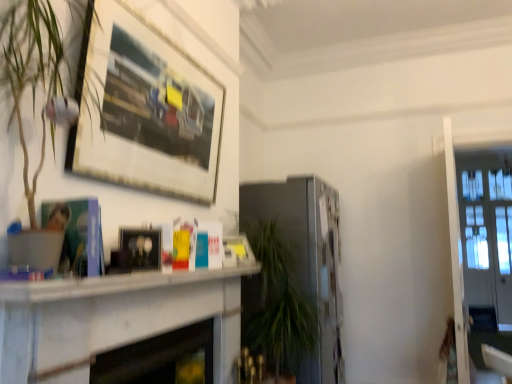
Question: Is white marble fireplace at center, positioned as the 2th fireplace in back-to-front order, not within satin silver fireplace at center, the first fireplace in the right-to-left sequence?

Choices:
 (A) no
 (B) yes

Answer: (B)

Question: Can you confirm if white marble fireplace at center, positioned as the 2th fireplace in back-to-front order, is shorter than satin silver fireplace at center, marked as the second fireplace in a left-to-right arrangement?

Choices:
 (A) no
 (B) yes

Answer: (B)

Question: Is white marble fireplace at center, arranged as the 1th fireplace when viewed from the front, further to the viewer compared to satin silver fireplace at center, marked as the second fireplace in a left-to-right arrangement?

Choices:
 (A) yes
 (B) no

Answer: (B)

Question: From the image's perspective, does white marble fireplace at center, arranged as the 1th fireplace when viewed from the front, appear higher than satin silver fireplace at center, the first fireplace in the right-to-left sequence?

Choices:
 (A) yes
 (B) no

Answer: (A)

Question: From a real-world perspective, does white marble fireplace at center, positioned as the 2th fireplace in back-to-front order, stand above satin silver fireplace at center, the 2th fireplace in the front-to-back sequence?

Choices:
 (A) yes
 (B) no

Answer: (B)

Question: In terms of height, does satin silver fireplace at center, marked as the second fireplace in a left-to-right arrangement, look taller or shorter compared to wooden picture frame at upper left, which is the 2th picture frame in bottom-to-top order?

Choices:
 (A) tall
 (B) short

Answer: (A)

Question: From the image's perspective, relative to wooden picture frame at upper left, which appears as the 1th picture frame when viewed from the top, is satin silver fireplace at center, the first fireplace in the right-to-left sequence, above or below?

Choices:
 (A) above
 (B) below

Answer: (B)

Question: Is satin silver fireplace at center, the first fireplace viewed from the back, situated inside wooden picture frame at upper left, which appears as the 1th picture frame when viewed from the top, or outside?

Choices:
 (A) inside
 (B) outside

Answer: (B)

Question: Considering the relative positions of satin silver fireplace at center, marked as the second fireplace in a left-to-right arrangement, and wooden picture frame at upper left, which appears as the 1th picture frame when viewed from the top, in the image provided, is satin silver fireplace at center, marked as the second fireplace in a left-to-right arrangement, to the left or to the right of wooden picture frame at upper left, which appears as the 1th picture frame when viewed from the top,?

Choices:
 (A) right
 (B) left

Answer: (A)

Question: From a real-world perspective, is white marble fireplace at center, the first fireplace in the left-to-right sequence, physically located above or below clear glass door at right?

Choices:
 (A) above
 (B) below

Answer: (B)

Question: Is point (131, 347) closer or farther from the camera than point (450, 170)?

Choices:
 (A) closer
 (B) farther

Answer: (A)

Question: From the image's perspective, relative to clear glass door at right, is white marble fireplace at center, placed as the 2th fireplace when sorted from right to left, above or below?

Choices:
 (A) above
 (B) below

Answer: (B)

Question: In terms of size, does white marble fireplace at center, the first fireplace in the left-to-right sequence, appear bigger or smaller than clear glass door at right?

Choices:
 (A) big
 (B) small

Answer: (B)

Question: Looking at their shapes, would you say clear glass door at right is wider or thinner than white marble fireplace at center, positioned as the 2th fireplace in back-to-front order?

Choices:
 (A) wide
 (B) thin

Answer: (A)

Question: From their relative heights in the image, would you say clear glass door at right is taller or shorter than white marble fireplace at center, arranged as the 1th fireplace when viewed from the front?

Choices:
 (A) tall
 (B) short

Answer: (A)